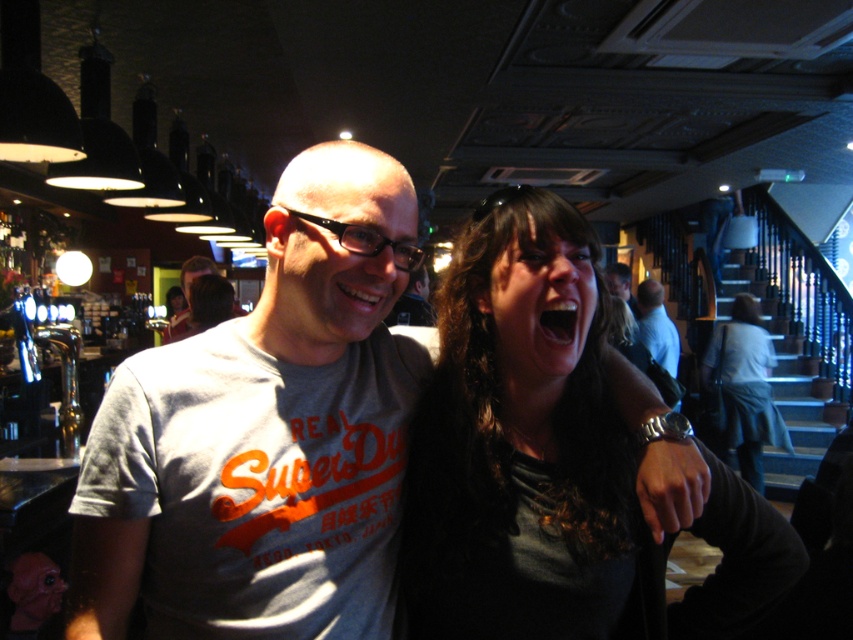
Find the location of a particular element. blue shirt at center is located at coordinates (657, 326).

Can you confirm if blue shirt at center is taller than smooth black shirt at upper center?

Yes.

Identify the location of blue shirt at center. (657, 326).

Does point (112, 561) come behind point (671, 324)?

No, it is in front of (671, 324).

Is gray cotton t-shirt at center positioned in front of blue shirt at center?

Yes.

Who is more forward, (323,166) or (668,342)?

Positioned in front is point (323,166).

In order to click on gray cotton t-shirt at center in this screenshot , I will do `click(265, 435)`.

Which is behind, point (735, 442) or point (613, 266)?

The point (735, 442) is more distant.

Does dark gray fabric skirt at right come behind smooth black shirt at upper center?

Yes, dark gray fabric skirt at right is behind smooth black shirt at upper center.

The image size is (853, 640). What do you see at coordinates (746, 387) in the screenshot?
I see `dark gray fabric skirt at right` at bounding box center [746, 387].

The image size is (853, 640). Identify the location of dark gray fabric skirt at right. (x=746, y=387).